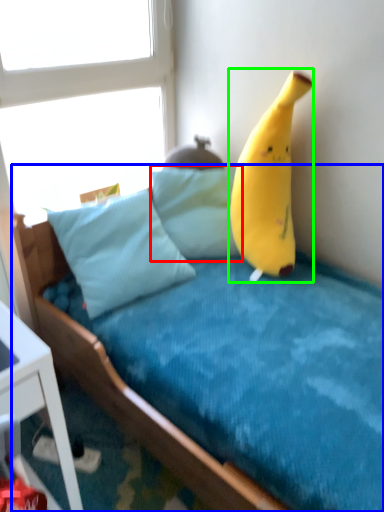
Question: Estimate the real-world distances between objects in this image. Which object is farther from pillow (highlighted by a red box), bed (highlighted by a blue box) or banana (highlighted by a green box)?

Choices:
 (A) bed
 (B) banana

Answer: (A)